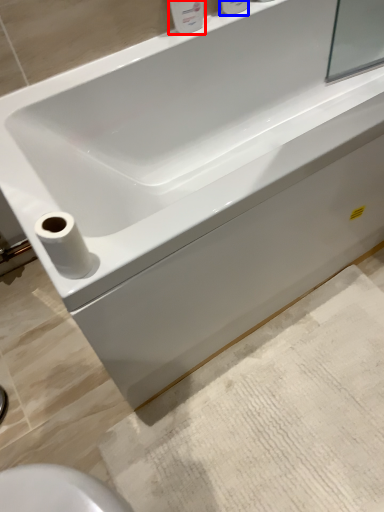
Question: Which object appears farthest to the camera in this image, toiletry (highlighted by a red box) or toiletry (highlighted by a blue box)?

Choices:
 (A) toiletry
 (B) toiletry

Answer: (B)